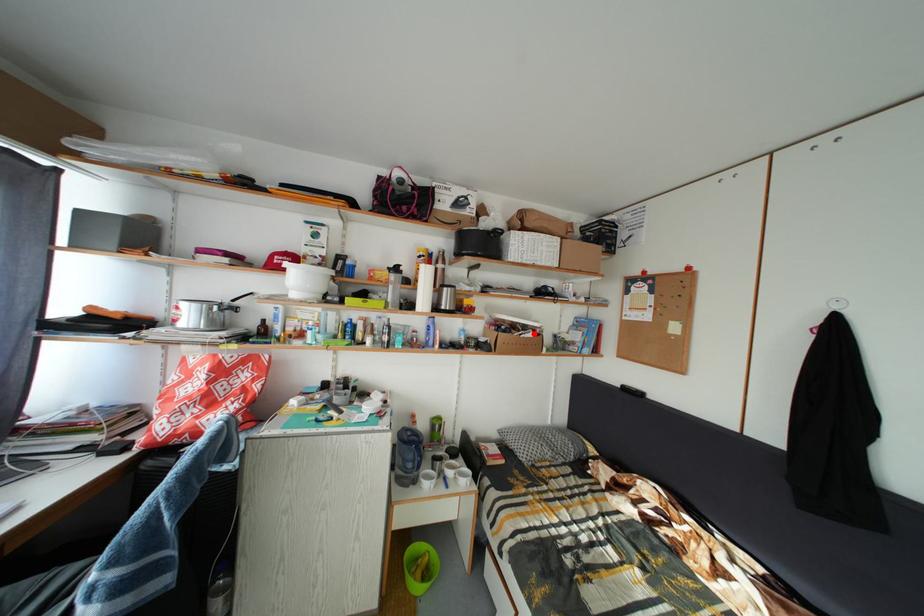
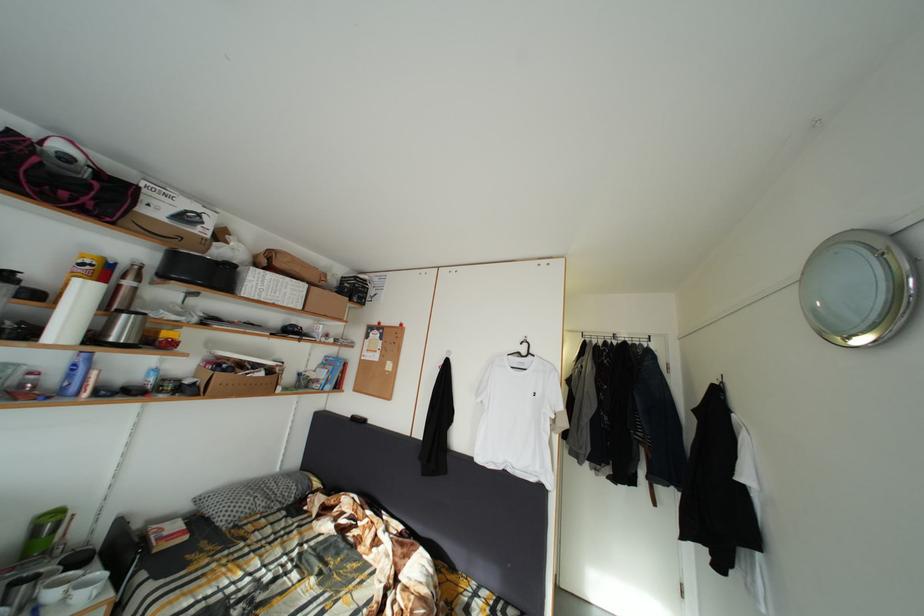
Locate, in the second image, the point that corresponds to the highlighted location in the first image.

(264, 373)